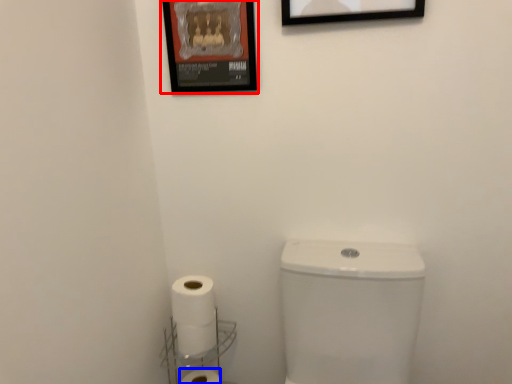
Question: Which object appears closest to the camera in this image, picture frame (highlighted by a red box) or toilet paper (highlighted by a blue box)?

Choices:
 (A) picture frame
 (B) toilet paper

Answer: (A)